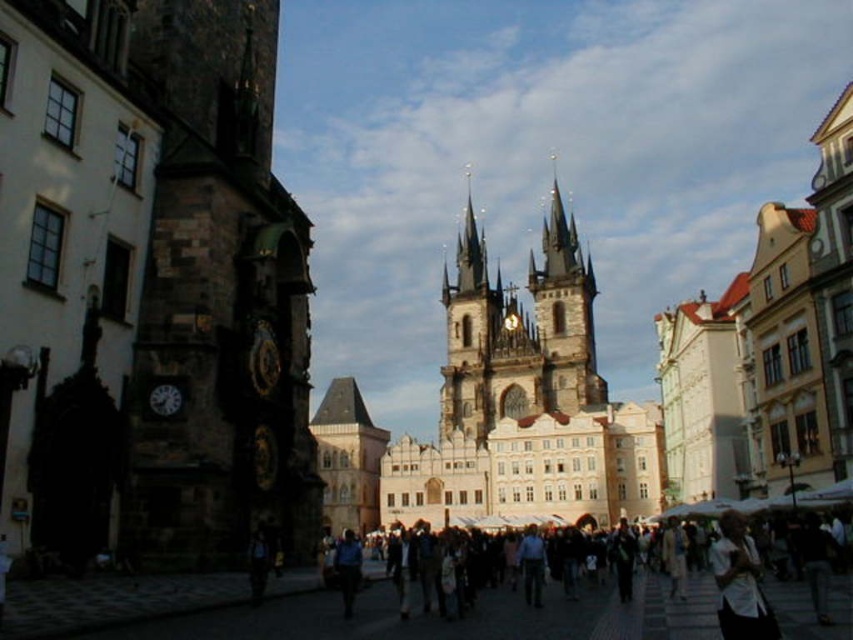
Between white matte shirt at lower right and blue fabric shirt at center, which one has more height?

With more height is blue fabric shirt at center.

From the picture: Does white matte shirt at lower right appear on the right side of blue fabric shirt at center?

Indeed, white matte shirt at lower right is positioned on the right side of blue fabric shirt at center.

The width and height of the screenshot is (853, 640). In order to click on white matte shirt at lower right in this screenshot , I will do `click(740, 582)`.

Is brown stone church at center above dark clothing crowd at center?

Indeed, brown stone church at center is positioned over dark clothing crowd at center.

Who is positioned more to the left, brown stone church at center or dark clothing crowd at center?

Positioned to the left is dark clothing crowd at center.

The height and width of the screenshot is (640, 853). I want to click on brown stone church at center, so click(x=524, y=403).

Locate an element on the screen. Image resolution: width=853 pixels, height=640 pixels. brown stone church at center is located at coordinates (524, 403).

Describe the element at coordinates (563, 616) in the screenshot. I see `dark clothing crowd at center` at that location.

Between point (505, 618) and point (749, 579), which one is positioned in front?

Point (749, 579)

Identify the location of dark clothing crowd at center. The width and height of the screenshot is (853, 640). (563, 616).